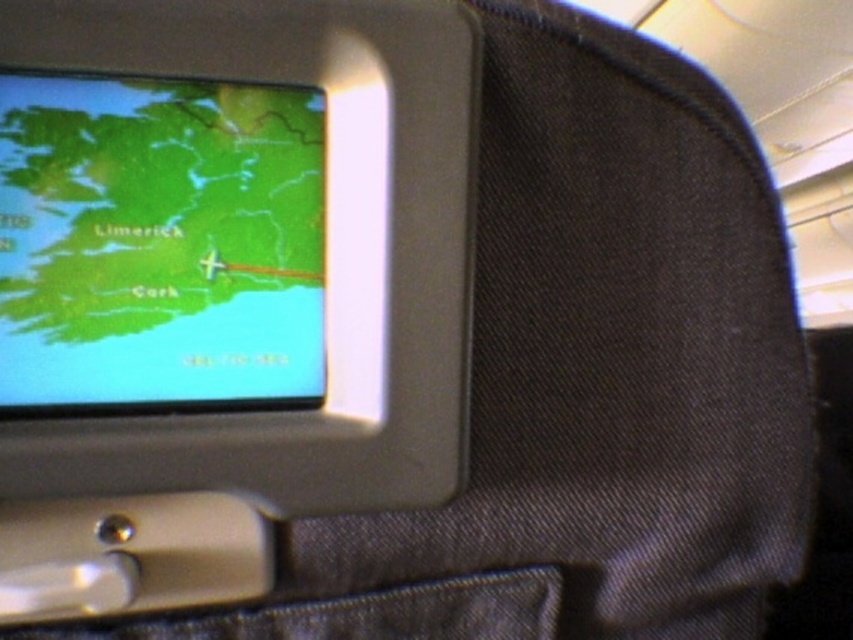
Based on the photo, you are a passenger on an airplane and want to check the seatback screen. From your seated position, which object is closer to you between the matte plastic screen at upper left and the denim at lower left?

The matte plastic screen at upper left is closer to you because it is in front of the denim at lower left.

From the picture: You are a passenger on a flight and want to check the flight path displayed on your seatback screen. You see a matte plastic screen at upper left and a green matte map at upper left. Which object is located lower on the screen?

The matte plastic screen at upper left is located below the green matte map at upper left, so the matte plastic screen at upper left is lower on the screen.

You are a flight attendant checking the seatback screen. You need to locate the green matte map at upper left. Where exactly is it positioned on the screen?

The green matte map at upper left is positioned at the coordinates point (x=158, y=244) on the screen.